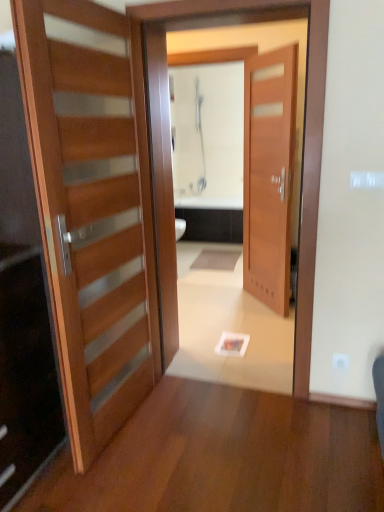
Find the location of a particular element. vacant space underneath wooden door at left, acting as the 1th door starting from the front (from a real-world perspective) is located at coordinates (127, 423).